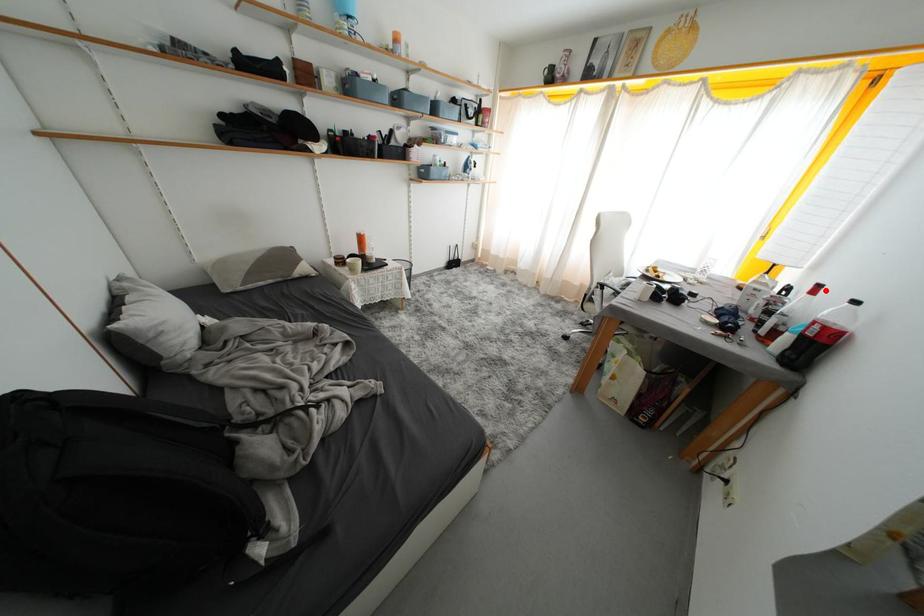
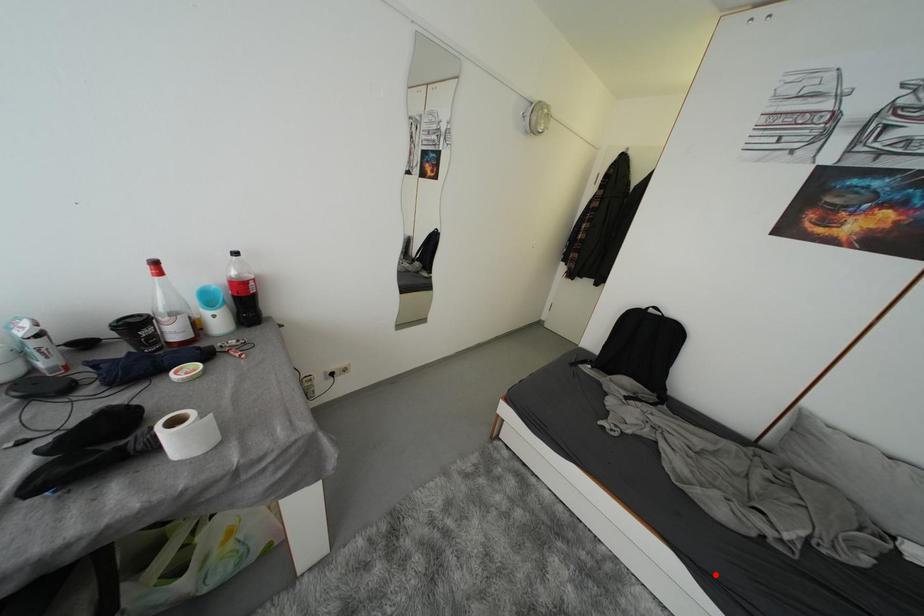
I am providing you with two images of the same scene from different viewpoints. A red point is marked on the first image and another point is marked on the second image. Does the point marked in image1 correspond to the same location as the one in image2?

No